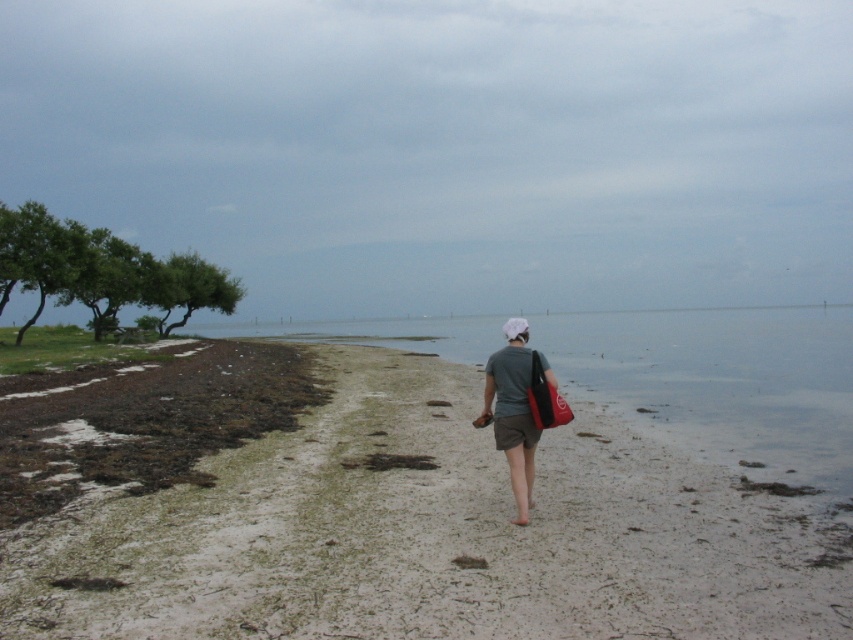
In the scene shown: You are standing at the center of the beach and want to reach the clear water at lower left. Which direction should you walk to get there?

Since the clear water at lower left is located at coordinates point (723, 380), you should walk towards the lower left direction to reach it.